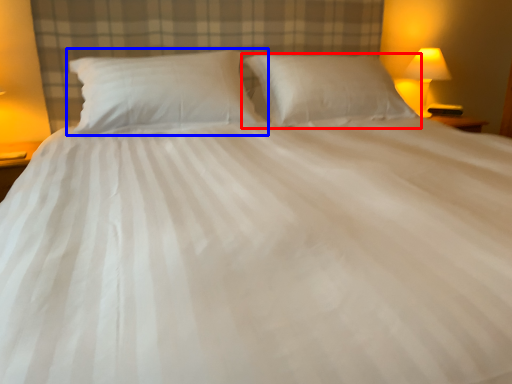
Question: Which point is closer to the camera, pillow (highlighted by a red box) or pillow (highlighted by a blue box)?

Choices:
 (A) pillow
 (B) pillow

Answer: (B)